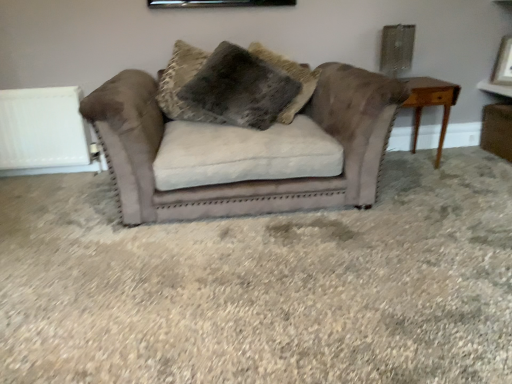
Question: Is light brown wooden table at right positioned with its back to matte white picture frame at upper right?

Choices:
 (A) no
 (B) yes

Answer: (A)

Question: Is light brown wooden table at right wider than matte white picture frame at upper right?

Choices:
 (A) yes
 (B) no

Answer: (A)

Question: From a real-world perspective, is light brown wooden table at right below matte white picture frame at upper right?

Choices:
 (A) yes
 (B) no

Answer: (A)

Question: Would you consider light brown wooden table at right to be distant from matte white picture frame at upper right?

Choices:
 (A) yes
 (B) no

Answer: (B)

Question: From a real-world perspective, is light brown wooden table at right on matte white picture frame at upper right?

Choices:
 (A) no
 (B) yes

Answer: (A)

Question: Considering the relative sizes of light brown wooden table at right and matte white picture frame at upper right in the image provided, is light brown wooden table at right smaller than matte white picture frame at upper right?

Choices:
 (A) no
 (B) yes

Answer: (A)

Question: Is matte white picture frame at upper right completely or partially outside of fuzzy brown pillow at center?

Choices:
 (A) no
 (B) yes

Answer: (B)

Question: Is matte white picture frame at upper right directly adjacent to fuzzy brown pillow at center?

Choices:
 (A) yes
 (B) no

Answer: (B)

Question: From the image's perspective, does matte white picture frame at upper right appear higher than fuzzy brown pillow at center?

Choices:
 (A) no
 (B) yes

Answer: (B)

Question: Can you confirm if matte white picture frame at upper right is bigger than fuzzy brown pillow at center?

Choices:
 (A) no
 (B) yes

Answer: (A)

Question: Considering the relative positions of matte white picture frame at upper right and fuzzy brown pillow at center in the image provided, is matte white picture frame at upper right to the right of fuzzy brown pillow at center from the viewer's perspective?

Choices:
 (A) no
 (B) yes

Answer: (B)

Question: Is there a large distance between matte white picture frame at upper right and fuzzy brown pillow at center?

Choices:
 (A) yes
 (B) no

Answer: (A)

Question: Can you confirm if fuzzy brown pillow at center is wider than suede couch at center?

Choices:
 (A) yes
 (B) no

Answer: (B)